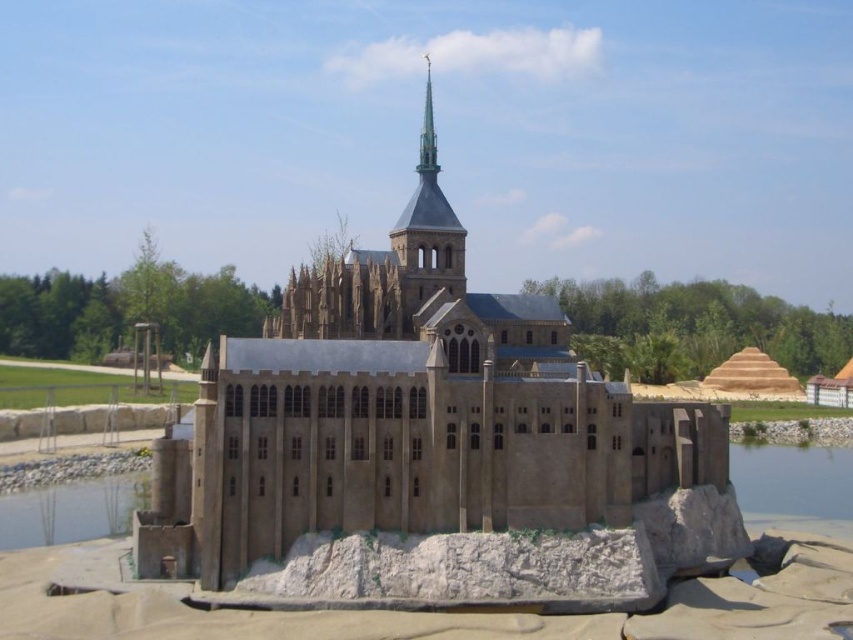
You are a GUI agent. You are given a task and a screenshot of the screen. Output one action in this format:
    pyautogui.click(x=<x>, y=<y>)
    Task: Click on the beige stone church at center
    The image size is (853, 640).
    Given the screenshot: What is the action you would take?
    pyautogui.click(x=407, y=413)

In the scene shown: Is beige stone church at center taller than clear water at lower right?

Correct, beige stone church at center is much taller as clear water at lower right.

Which is in front, point (448, 292) or point (790, 460)?

Point (448, 292) is in front.

I want to click on beige stone church at center, so click(407, 413).

Between clear water at lower right and clear water at lower left, which one has less height?

With less height is clear water at lower left.

Does clear water at lower right appear on the left side of clear water at lower left?

Incorrect, clear water at lower right is not on the left side of clear water at lower left.

This screenshot has width=853, height=640. I want to click on clear water at lower right, so click(x=792, y=481).

Between beige stone church at center and clear water at lower left, which one has more height?

With more height is beige stone church at center.

Does beige stone church at center appear over clear water at lower left?

Yes.

Does point (589, 432) lie in front of point (12, 509)?

Yes, point (589, 432) is in front of point (12, 509).

This screenshot has height=640, width=853. Find the location of `beige stone church at center`. beige stone church at center is located at coordinates (407, 413).